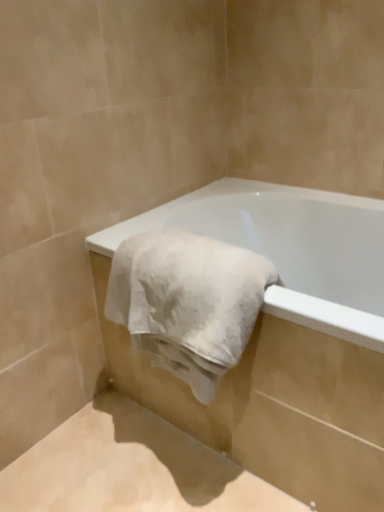
Identify the location of white soft towel at center. Image resolution: width=384 pixels, height=512 pixels. (188, 302).

Describe the element at coordinates (188, 302) in the screenshot. I see `white soft towel at center` at that location.

You are a GUI agent. You are given a task and a screenshot of the screen. Output one action in this format:
    pyautogui.click(x=<x>, y=<y>)
    Task: Click on the white matte bathtub at center
    
    Given the screenshot: What is the action you would take?
    pyautogui.click(x=289, y=249)

Describe the element at coordinates (289, 249) in the screenshot. I see `white matte bathtub at center` at that location.

You are a GUI agent. You are given a task and a screenshot of the screen. Output one action in this format:
    pyautogui.click(x=<x>, y=<y>)
    Task: Click on the white soft towel at center
    
    Given the screenshot: What is the action you would take?
    pyautogui.click(x=188, y=302)

Visually, is white matte bathtub at center positioned to the left or to the right of white soft towel at center?

Based on their positions, white matte bathtub at center is located to the right of white soft towel at center.

Is the position of white matte bathtub at center more distant than that of white soft towel at center?

No, white matte bathtub at center is closer to the camera.

Does point (274, 211) appear closer or farther from the camera than point (166, 335)?

Point (274, 211) is positioned farther from the camera compared to point (166, 335).

From the image's perspective, is white matte bathtub at center positioned above or below white soft towel at center?

From the image's perspective, white matte bathtub at center appears below white soft towel at center.

From a real-world perspective, who is located lower, white matte bathtub at center or white soft towel at center?

white matte bathtub at center.

Between white matte bathtub at center and white soft towel at center, which one has smaller width?

white soft towel at center.

Who is taller, white matte bathtub at center or white soft towel at center?

With more height is white matte bathtub at center.

Considering the relative sizes of white matte bathtub at center and white soft towel at center in the image provided, is white matte bathtub at center smaller than white soft towel at center?

Incorrect, white matte bathtub at center is not smaller in size than white soft towel at center.

Would you say white matte bathtub at center is outside white soft towel at center?

Yes, white matte bathtub at center is outside of white soft towel at center.

Is white matte bathtub at center with white soft towel at center?

No, white matte bathtub at center is not in contact with white soft towel at center.

Is white matte bathtub at center facing towards white soft towel at center?

Yes, white matte bathtub at center is aimed at white soft towel at center.

In order to click on towel lying on the left of white matte bathtub at center in this screenshot , I will do `click(188, 302)`.

Which object is positioned more to the right, white soft towel at center or white matte bathtub at center?

white matte bathtub at center.

Considering the relative positions of white soft towel at center and white matte bathtub at center in the image provided, is white soft towel at center behind white matte bathtub at center?

Yes.

Is point (109, 286) positioned before point (369, 331)?

No.

From the image's perspective, who appears lower, white soft towel at center or white matte bathtub at center?

white matte bathtub at center appears lower in the image.

From a real-world perspective, is white soft towel at center on top of white matte bathtub at center?

Yes, from a real-world perspective, white soft towel at center is above white matte bathtub at center.

Considering the sizes of objects white soft towel at center and white matte bathtub at center in the image provided, who is wider, white soft towel at center or white matte bathtub at center?

white matte bathtub at center.

Which of these two, white soft towel at center or white matte bathtub at center, stands shorter?

With less height is white soft towel at center.

Considering the relative sizes of white soft towel at center and white matte bathtub at center in the image provided, is white soft towel at center smaller than white matte bathtub at center?

Yes, white soft towel at center is smaller than white matte bathtub at center.

Would you say white soft towel at center is inside or outside white matte bathtub at center?

white soft towel at center lies within the bounds of white matte bathtub at center.

Is white soft towel at center positioned far away from white matte bathtub at center?

white soft towel at center is near white matte bathtub at center, not far away.

Is white soft towel at center aimed at white matte bathtub at center?

Yes, white soft towel at center is turned towards white matte bathtub at center.

At what (x,y) coordinates should I click in order to perform the action: click on towel above the white matte bathtub at center (from a real-world perspective). Please return your answer as a coordinate pair (x, y). Looking at the image, I should click on (188, 302).

I want to click on towel above the white matte bathtub at center (from a real-world perspective), so point(188,302).

The image size is (384, 512). In order to click on bathtub that is in front of the white soft towel at center in this screenshot , I will do `click(289, 249)`.